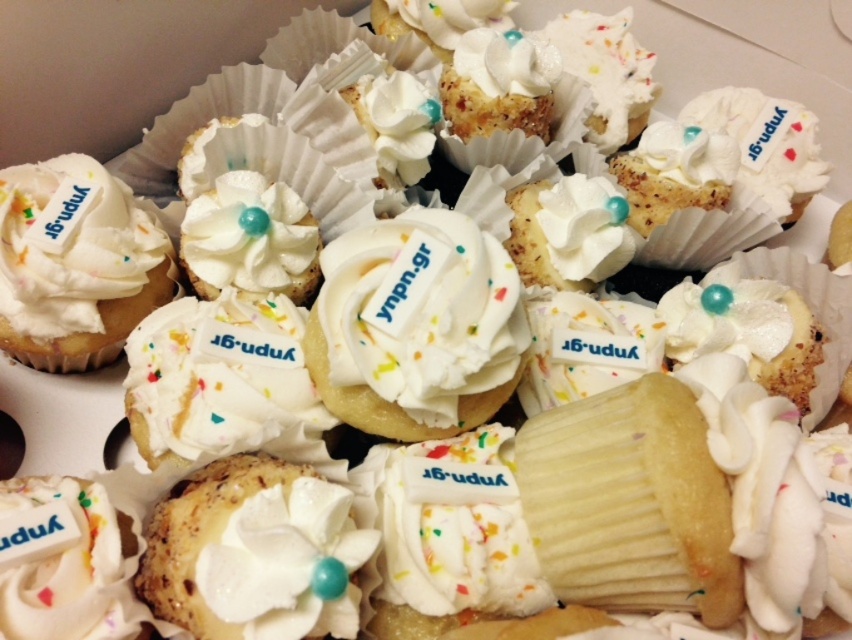
Looking at the cupcakes in the box, which one is positioned to the right of the other between the white cream cupcake at center and the white matte cupcake at left?

The white cream cupcake at center is positioned to the right of the white matte cupcake at left.

You are a customer at a bakery and see two cupcakes in the display case. You want to choose the smaller one. Which one should you pick between the white cream cupcake at center and the white matte cupcake at left?

The white cream cupcake at center is smaller than the white matte cupcake at left, so you should pick the white cream cupcake at center.